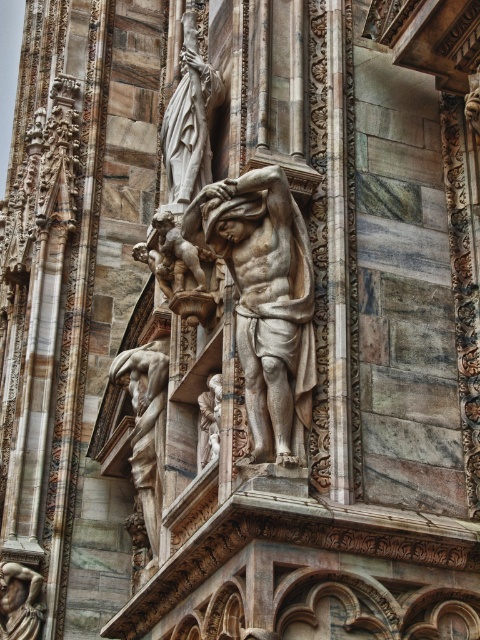
Question: Which object appears farthest from the camera in this image?

Choices:
 (A) polished marble cherub at center
 (B) polished stone statue at center

Answer: (B)

Question: Is the position of white marble statue at upper left less distant than that of polished marble cherub at center?

Choices:
 (A) no
 (B) yes

Answer: (A)

Question: Which object is closer to the camera taking this photo?

Choices:
 (A) marble statue at center
 (B) polished marble cherub at center
 (C) white marble statue at upper left
 (D) polished stone statue at center

Answer: (A)

Question: Is white marble statue at upper left to the left of polished bronze statue at lower left from the viewer's perspective?

Choices:
 (A) yes
 (B) no

Answer: (B)

Question: Can you confirm if white marble statue at upper left is positioned below polished stone statue at center?

Choices:
 (A) yes
 (B) no

Answer: (B)

Question: Among these objects, which one is nearest to the camera?

Choices:
 (A) white marble statue at upper left
 (B) polished marble cherub at center
 (C) polished stone statue at center
 (D) polished bronze statue at lower left

Answer: (B)